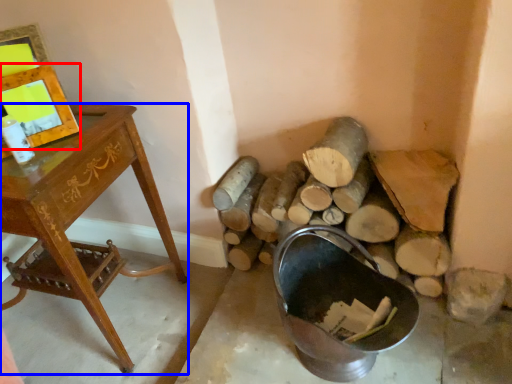
Question: Among these objects, which one is farthest to the camera, picture frame (highlighted by a red box) or desk (highlighted by a blue box)?

Choices:
 (A) picture frame
 (B) desk

Answer: (A)